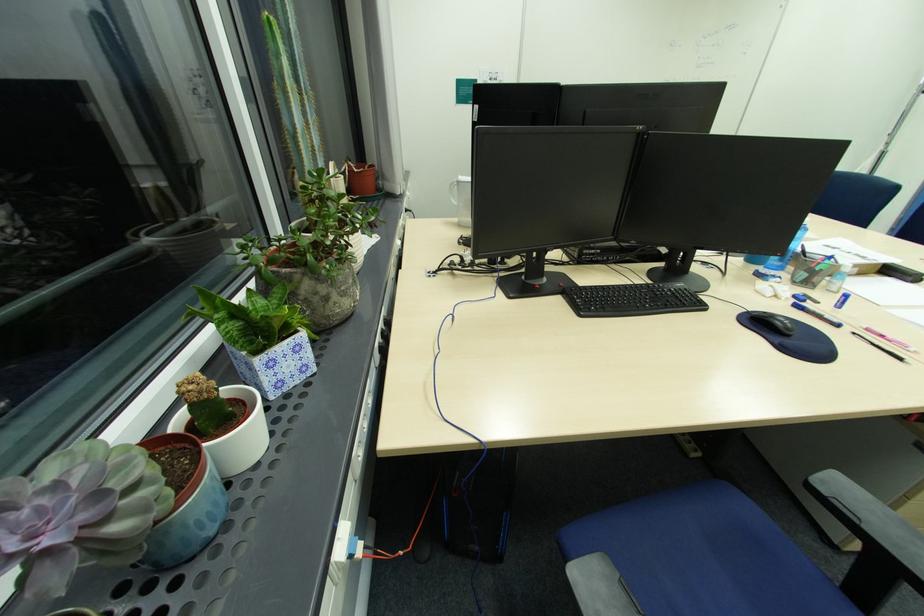
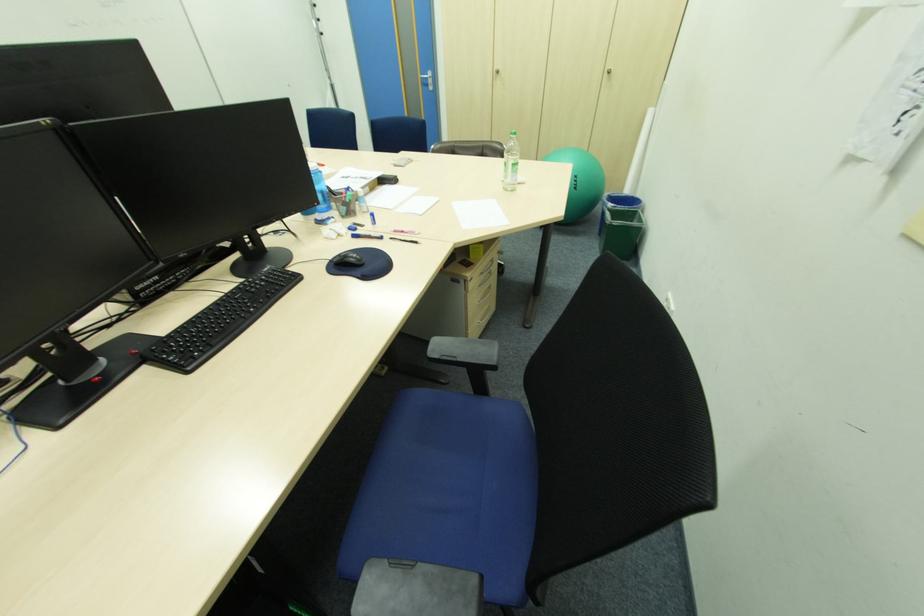
Find the pixel in the second image that matches (810,276) in the first image.

(349, 209)